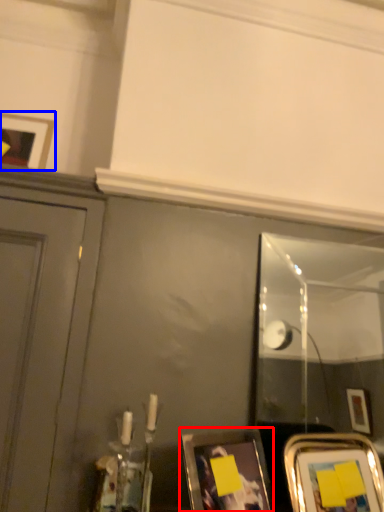
Question: Which object is further to the camera taking this photo, picture frame (highlighted by a red box) or picture frame (highlighted by a blue box)?

Choices:
 (A) picture frame
 (B) picture frame

Answer: (B)